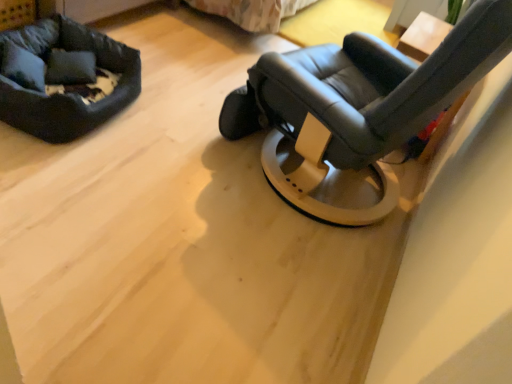
Find the location of a particular element. Image resolution: width=512 pixels, height=384 pixels. vacant space positioned to the left of matte black chair at center is located at coordinates (162, 115).